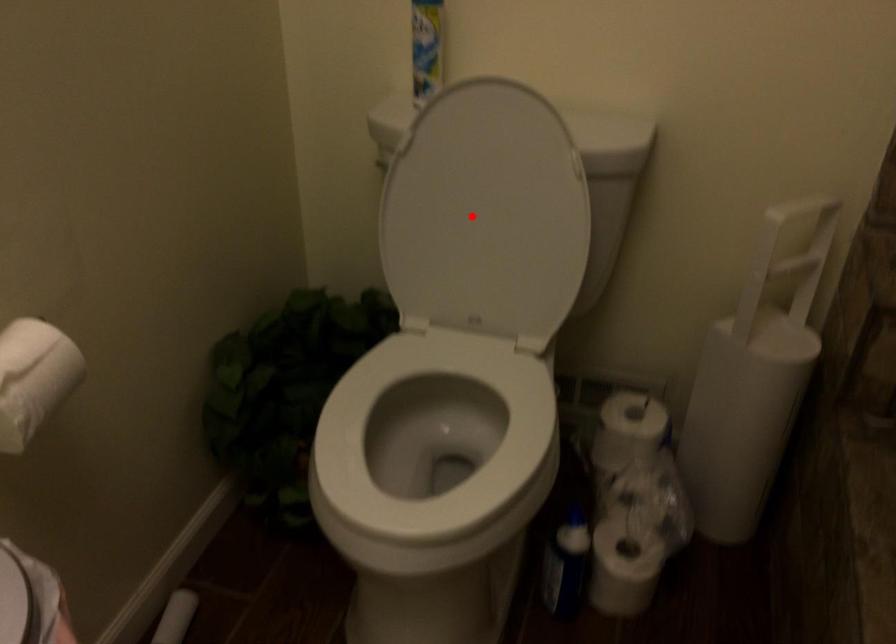
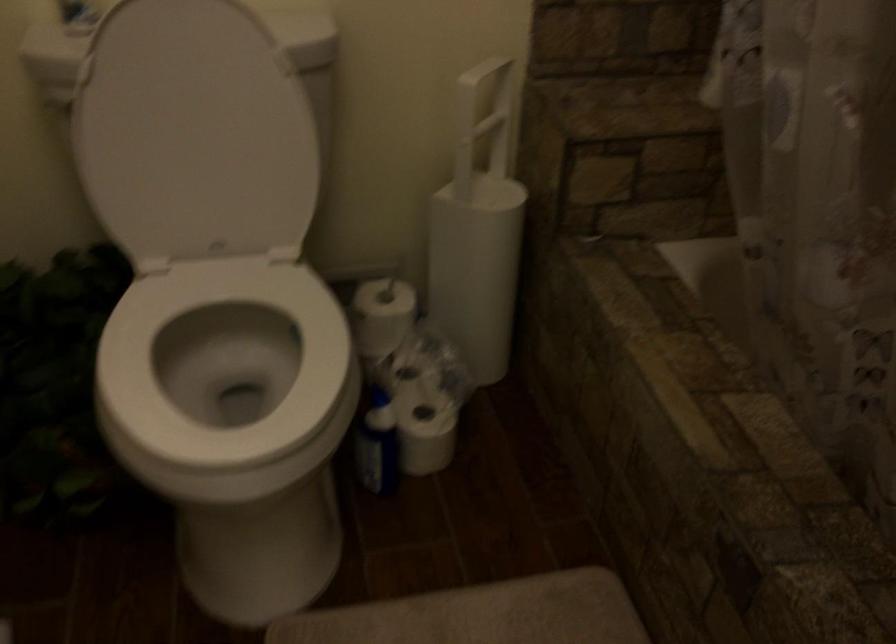
Find the pixel in the second image that matches the highlighted location in the first image.

(194, 134)